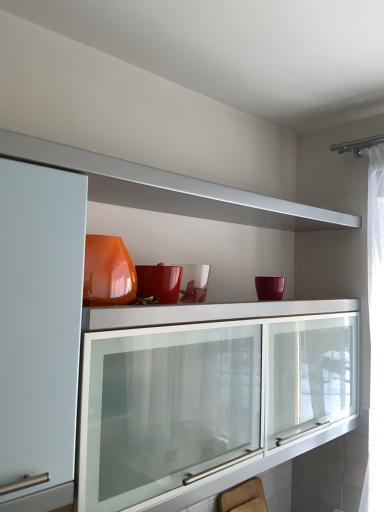
Question: Looking at their shapes, would you say matte orange vase at upper center is wider or thinner than wooden swivel chair at lower center?

Choices:
 (A) thin
 (B) wide

Answer: (B)

Question: From a real-world perspective, is matte orange vase at upper center physically located above or below wooden swivel chair at lower center?

Choices:
 (A) above
 (B) below

Answer: (A)

Question: Is matte orange vase at upper center inside the boundaries of wooden swivel chair at lower center, or outside?

Choices:
 (A) outside
 (B) inside

Answer: (A)

Question: Choose the correct answer: Is wooden swivel chair at lower center inside matte orange vase at upper center or outside it?

Choices:
 (A) inside
 (B) outside

Answer: (B)

Question: Considering the positions of point (233, 492) and point (301, 207), is point (233, 492) closer or farther from the camera than point (301, 207)?

Choices:
 (A) closer
 (B) farther

Answer: (B)

Question: Is wooden swivel chair at lower center bigger or smaller than matte orange vase at upper center?

Choices:
 (A) small
 (B) big

Answer: (A)

Question: From a real-world perspective, relative to matte orange vase at upper center, is wooden swivel chair at lower center vertically above or below?

Choices:
 (A) below
 (B) above

Answer: (A)